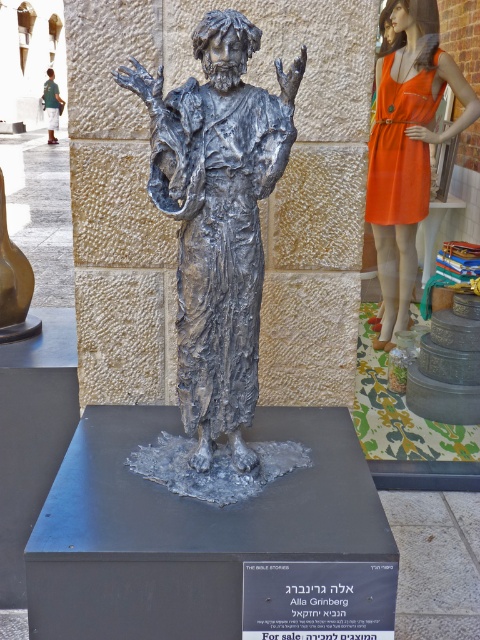
You are an art installer who needs to move the orange fabric dress at upper right closer to the shiny silver statue at center. How much distance do you need to cover to bring them together?

The distance between the shiny silver statue at center and the orange fabric dress at upper right is 3.48 meters, so you need to cover 3.48 meters to bring them together.